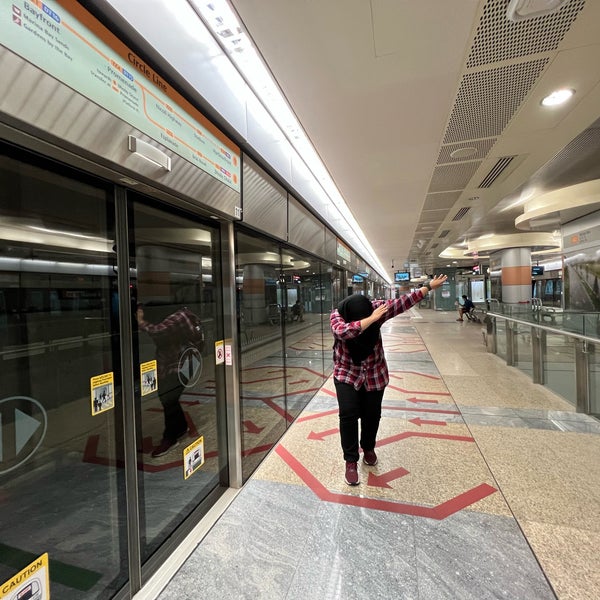
This screenshot has height=600, width=600. Identify the location of floor. (553, 497).